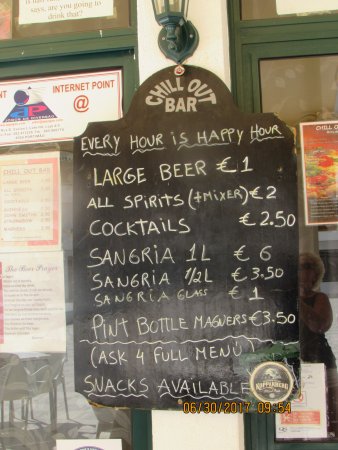
You are a GUI agent. You are given a task and a screenshot of the screen. Output one action in this format:
    pyautogui.click(x=<x>, y=<y>)
    Task: Click on the colorful paper taped to right window
    
    Given the screenshot: What is the action you would take?
    pyautogui.click(x=320, y=135)